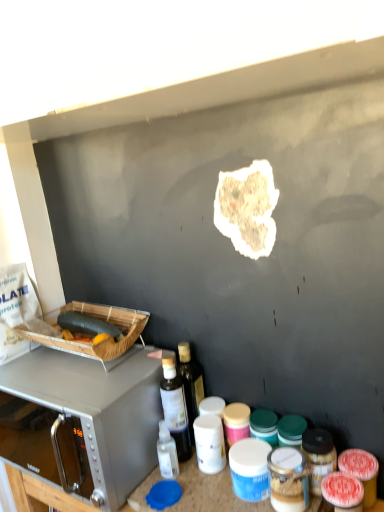
Image resolution: width=384 pixels, height=512 pixels. What are the coordinates of `matte plastic container at center, the 2th appliance from the left` in the screenshot? It's located at (288, 480).

The width and height of the screenshot is (384, 512). Describe the element at coordinates (87, 324) in the screenshot. I see `green matte zucchini at left, placed as the first food when sorted from bottom to top` at that location.

Measure the distance between point [32,384] and camera.

The distance of point [32,384] from camera is 1.08 meters.

What do you see at coordinates (100, 408) in the screenshot? The image size is (384, 512). I see `satin silver microwave at upper left` at bounding box center [100, 408].

In order to face translucent plastic bottle at center, should I rotate leftwards or rightwards?

Rotate left and turn 2.909 degrees.

Describe the element at coordinates (99, 343) in the screenshot. I see `wooden crate at left, which is the second appliance from bottom to top` at that location.

Locate an element on the screen. This screenshot has height=512, width=384. matte plastic container at center, the first appliance positioned from the front is located at coordinates (288, 480).

Is brown crumbly bread at center, acting as the 1th food starting from the right, bigger or smaller than matte plastic container at center, the first appliance positioned from the front?

Considering their sizes, brown crumbly bread at center, acting as the 1th food starting from the right, takes up less space than matte plastic container at center, the first appliance positioned from the front.

Does brown crumbly bread at center, the 2th food from the back, appear on the left side of matte plastic container at center, the 1th appliance from the right?

Correct, you'll find brown crumbly bread at center, the 2th food from the back, to the left of matte plastic container at center, the 1th appliance from the right.

This screenshot has width=384, height=512. I want to click on the 2nd appliance positioned below the brown crumbly bread at center, the 2th food from the back (from a real-world perspective), so click(x=288, y=480).

Which of these two, matte plastic container at center, the 1th appliance from the right, or translucent plastic bottle at center, is thinner?

Thinner between the two is translucent plastic bottle at center.

From the picture: Considering their positions, is matte plastic container at center, the second appliance in the back-to-front sequence, located in front of or behind translucent plastic bottle at center?

In the image, matte plastic container at center, the second appliance in the back-to-front sequence, appears in front of translucent plastic bottle at center.

In the scene shown: Which is less distant, (297, 459) or (175, 438)?

Point (297, 459).

In terms of height, does matte plastic container at center, which is the second appliance from top to bottom, look taller or shorter compared to translucent plastic bottle at center?

Considering their sizes, matte plastic container at center, which is the second appliance from top to bottom, has less height than translucent plastic bottle at center.

Considering the sizes of green matte zucchini at left, arranged as the 2th food when viewed from the front, and translucent plastic bottle at center in the image, is green matte zucchini at left, arranged as the 2th food when viewed from the front, taller or shorter than translucent plastic bottle at center?

In the image, green matte zucchini at left, arranged as the 2th food when viewed from the front, appears to be shorter than translucent plastic bottle at center.

Is green matte zucchini at left, arranged as the 2th food when viewed from the front, outside of translucent plastic bottle at center?

Yes, green matte zucchini at left, arranged as the 2th food when viewed from the front, is not within translucent plastic bottle at center.

Considering the sizes of green matte zucchini at left, marked as the 2th food in a top-to-bottom arrangement, and translucent plastic bottle at center in the image, is green matte zucchini at left, marked as the 2th food in a top-to-bottom arrangement, wider or thinner than translucent plastic bottle at center?

Clearly, green matte zucchini at left, marked as the 2th food in a top-to-bottom arrangement, has less width compared to translucent plastic bottle at center.

Is the position of green matte zucchini at left, which ranks as the 1th food in back-to-front order, more distant than that of translucent plastic bottle at center?

That is True.

Is matte plastic container at center, the second appliance in the back-to-front sequence, directly adjacent to satin silver microwave at upper left?

No, matte plastic container at center, the second appliance in the back-to-front sequence, is not with satin silver microwave at upper left.

Would you say matte plastic container at center, the 1th appliance from the right, contains satin silver microwave at upper left?

No, satin silver microwave at upper left is not surrounded by matte plastic container at center, the 1th appliance from the right.

Considering the sizes of objects matte plastic container at center, the second appliance in the back-to-front sequence, and satin silver microwave at upper left in the image provided, who is bigger, matte plastic container at center, the second appliance in the back-to-front sequence, or satin silver microwave at upper left?

With larger size is satin silver microwave at upper left.

Considering the points (308, 493) and (60, 408), which point is behind, point (308, 493) or point (60, 408)?

Positioned behind is point (60, 408).

From a real-world perspective, is green matte zucchini at left, placed as the first food when sorted from bottom to top, on top of wooden crate at left, which is counted as the first appliance, starting from the top?

Yes, from a real-world perspective, green matte zucchini at left, placed as the first food when sorted from bottom to top, is on top of wooden crate at left, which is counted as the first appliance, starting from the top.

Consider the image. Is green matte zucchini at left, placed as the first food when sorted from bottom to top, facing away from wooden crate at left, which is counted as the first appliance, starting from the top?

Absolutely, green matte zucchini at left, placed as the first food when sorted from bottom to top, is directed away from wooden crate at left, which is counted as the first appliance, starting from the top.

Who is bigger, green matte zucchini at left, arranged as the first food when viewed from the left, or wooden crate at left, which is the first appliance from back to front?

With larger size is wooden crate at left, which is the first appliance from back to front.

Which of these two, green matte zucchini at left, which is the second food from right to left, or wooden crate at left, which is the second appliance in front-to-back order, stands shorter?

green matte zucchini at left, which is the second food from right to left, is shorter.

From the image's perspective, does satin silver microwave at upper left appear lower than translucent plastic bottle at center?

Yes.

Can you confirm if satin silver microwave at upper left is wider than translucent plastic bottle at center?

Yes.

Which is closer to the camera, (x=70, y=407) or (x=177, y=397)?

Answer: The point (x=70, y=407) is closer.

Considering the sizes of objects satin silver microwave at upper left and translucent plastic bottle at center in the image provided, who is bigger, satin silver microwave at upper left or translucent plastic bottle at center?

satin silver microwave at upper left is bigger.

From a real-world perspective, between green matte zucchini at left, placed as the first food when sorted from bottom to top, and satin silver microwave at upper left, who is vertically higher?

In real-world perspective, green matte zucchini at left, placed as the first food when sorted from bottom to top, is above.

Measure the distance from green matte zucchini at left, which ranks as the 1th food in back-to-front order, to satin silver microwave at upper left.

A distance of 7.37 inches exists between green matte zucchini at left, which ranks as the 1th food in back-to-front order, and satin silver microwave at upper left.

Which object is thinner, green matte zucchini at left, arranged as the 2th food when viewed from the front, or satin silver microwave at upper left?

With smaller width is green matte zucchini at left, arranged as the 2th food when viewed from the front.

Would you consider green matte zucchini at left, arranged as the first food when viewed from the left, to be distant from satin silver microwave at upper left?

No, green matte zucchini at left, arranged as the first food when viewed from the left, is in close proximity to satin silver microwave at upper left.

This screenshot has width=384, height=512. I want to click on appliance that is in front of the brown crumbly bread at center, the first food viewed from the front, so click(288, 480).

The height and width of the screenshot is (512, 384). What are the coordinates of `bottle on the left of matte plastic container at center, which is the second appliance from top to bottom` in the screenshot? It's located at (175, 407).

Considering their positions, is satin silver microwave at upper left positioned closer to brown crumbly bread at center, which ranks as the 1th food in top-to-bottom order, than green matte zucchini at left, arranged as the first food when viewed from the left?

green matte zucchini at left, arranged as the first food when viewed from the left, lies closer to brown crumbly bread at center, which ranks as the 1th food in top-to-bottom order, than the other object.

Based on their spatial positions, is translucent plastic bottle at center or green matte zucchini at left, arranged as the first food when viewed from the left, further from wooden crate at left, the first appliance when ordered from left to right?

translucent plastic bottle at center lies further to wooden crate at left, the first appliance when ordered from left to right, than the other object.

Considering their positions, is matte plastic container at center, the first appliance positioned from the front, positioned closer to satin silver microwave at upper left than green matte zucchini at left, arranged as the first food when viewed from the left?

green matte zucchini at left, arranged as the first food when viewed from the left, lies closer to satin silver microwave at upper left than the other object.

Considering their positions, is wooden crate at left, the first appliance when ordered from left to right, positioned further to matte plastic container at center, the 2th appliance from the left, than satin silver microwave at upper left?

wooden crate at left, the first appliance when ordered from left to right, is positioned further to the anchor matte plastic container at center, the 2th appliance from the left.

Which object lies further to the anchor point wooden crate at left, which is counted as the first appliance, starting from the top, matte plastic container at center, the second appliance in the back-to-front sequence, or satin silver microwave at upper left?

matte plastic container at center, the second appliance in the back-to-front sequence, is further to wooden crate at left, which is counted as the first appliance, starting from the top.

Considering their positions, is green matte zucchini at left, placed as the first food when sorted from bottom to top, positioned closer to wooden crate at left, the second appliance positioned from the right, than brown crumbly bread at center, the 2th food from the back?

green matte zucchini at left, placed as the first food when sorted from bottom to top, lies closer to wooden crate at left, the second appliance positioned from the right, than the other object.

Which object lies further to the anchor point translucent plastic bottle at center, matte plastic container at center, the 2th appliance from the left, or brown crumbly bread at center, which ranks as the 1th food in top-to-bottom order?

Among the two, brown crumbly bread at center, which ranks as the 1th food in top-to-bottom order, is located further to translucent plastic bottle at center.

Considering their positions, is green matte zucchini at left, placed as the first food when sorted from bottom to top, positioned further to wooden crate at left, which is the second appliance in front-to-back order, than matte plastic container at center, which is the 1th appliance from bottom to top?

matte plastic container at center, which is the 1th appliance from bottom to top, is further to wooden crate at left, which is the second appliance in front-to-back order.

Image resolution: width=384 pixels, height=512 pixels. Identify the location of appliance situated between satin silver microwave at upper left and translucent plastic bottle at center from left to right. (99, 343).

This screenshot has height=512, width=384. I want to click on food between brown crumbly bread at center, the first food viewed from the front, and translucent plastic bottle at center in the up-down direction, so click(87, 324).

This screenshot has width=384, height=512. I want to click on appliance between brown crumbly bread at center, the first food viewed from the front, and translucent plastic bottle at center vertically, so click(99, 343).

This screenshot has width=384, height=512. I want to click on food between brown crumbly bread at center, which ranks as the 1th food in top-to-bottom order, and matte plastic container at center, the 2th appliance from the left, in the vertical direction, so click(x=87, y=324).